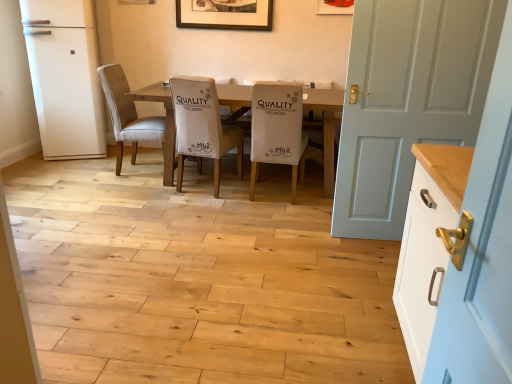
Locate an element on the screen. free space between white fabric chair at center, which is the 2th chair from left to right, and white painted wood cabinet at right is located at coordinates (281, 253).